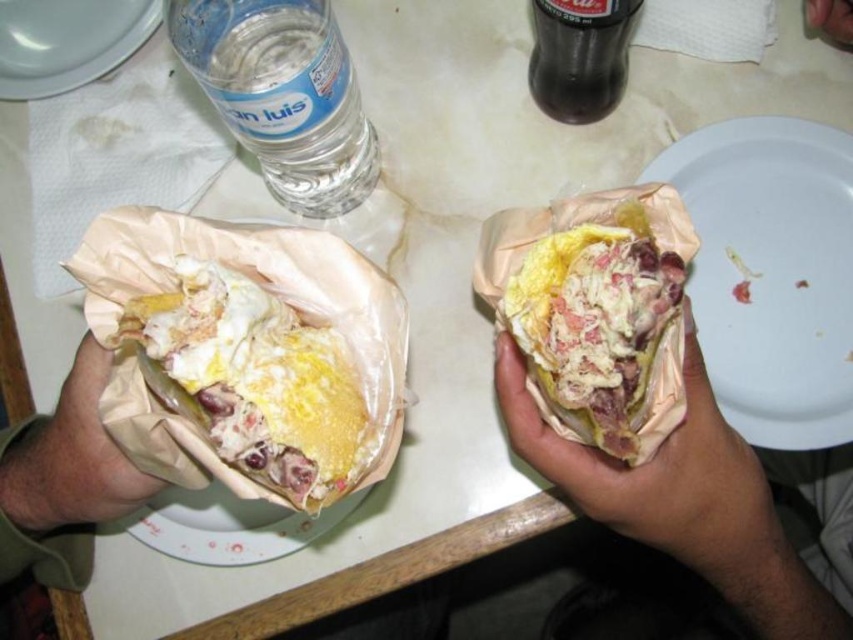
You are a food critic who needs to take a closeup photo of the yellowish matte sandwich at center. Your camera has a minimum focusing distance of 16 inches. Will you be able to take the photo without moving the sandwich?

The yellowish matte sandwich at center is 17.04 inches away from the camera. Since the minimum focusing distance is 16 inches, you can take the photo without moving the sandwich because it is within the camera range.

You are setting up a picnic and need to place the white matte plate at right on the table. Based on the scene description, where should you position it relative to the sandwiches?

The white matte plate at right is located at point (770, 273), so position it at those coordinates relative to the sandwiches.

You have two plates on the table, a white matte plate at right and a white glossy plate at upper left. If you want to place a large pizza on one of them, which plate should you choose based on size?

The white matte plate at right has a larger width than the white glossy plate at upper left, so you should choose the white matte plate at right to place the large pizza.